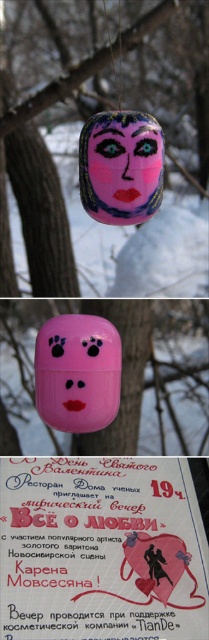
You are standing in front of the image and want to touch both points. Which point should you reach for first, point (34, 102) or point (94, 406)?

You should reach for point (34, 102) first because it is closer to you than point (94, 406), which is further away.

Based on the photo, you are an interior designer planning to place the slightly glossy wood at upper center and the pink matte toy at center on a shelf. Which object should you place first if you want to follow the rule of placing larger items before smaller ones?

The slightly glossy wood at upper center is larger in size than the pink matte toy at center, so you should place the slightly glossy wood at upper center first.